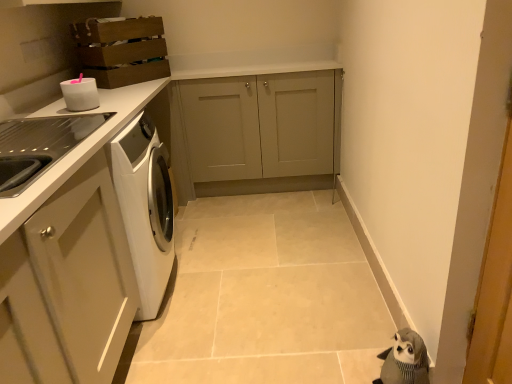
Where is `unoccupied area in front of white glossy container at upper left`? Image resolution: width=512 pixels, height=384 pixels. unoccupied area in front of white glossy container at upper left is located at coordinates (61, 115).